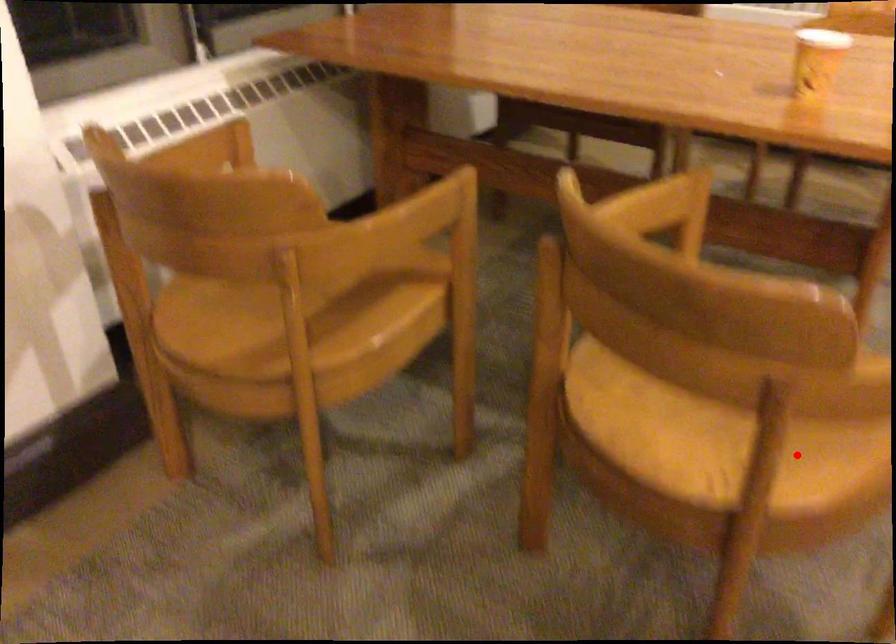
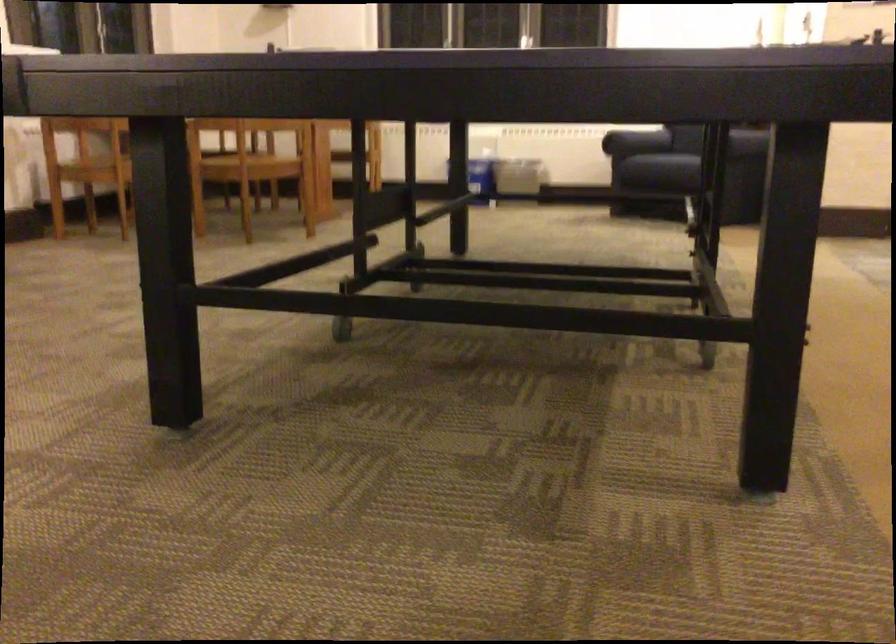
Find the pixel in the second image that matches the highlighted location in the first image.

(248, 160)